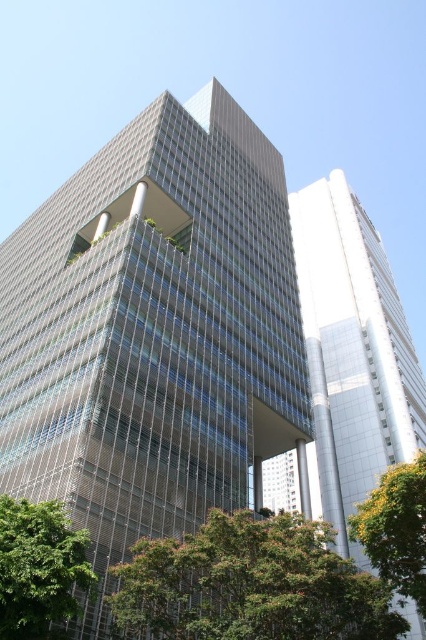
You are standing in the middle of the scene and want to take a photo of both green leafy tree at lower center and green leafy tree at lower left. Which tree should you focus on first if you want to capture both in the frame without moving the camera?

You should focus on the green leafy tree at lower center first because it is much taller than the green leafy tree at lower left, so adjusting the camera angle to include its height will naturally include the shorter tree as well.

You are standing in front of the two buildings and want to determine which point is closer to you. The first point is at coordinates point (x=201, y=298) and the second is at point (x=154, y=582). Which point is closer to your current position?

Point (x=154, y=582) is closer to you because the description states that point (x=201, y=298) is further away than point (x=154, y=582).